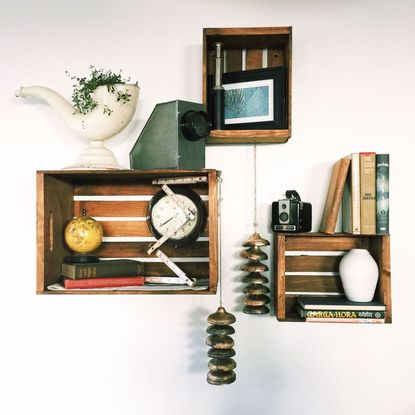
Identify the location of book. Image resolution: width=415 pixels, height=415 pixels. point(335,319).